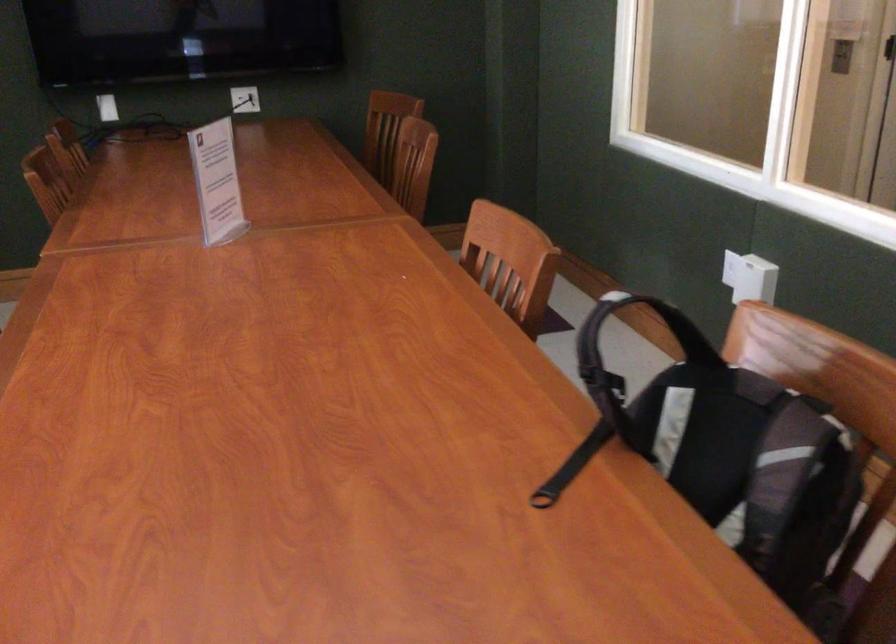
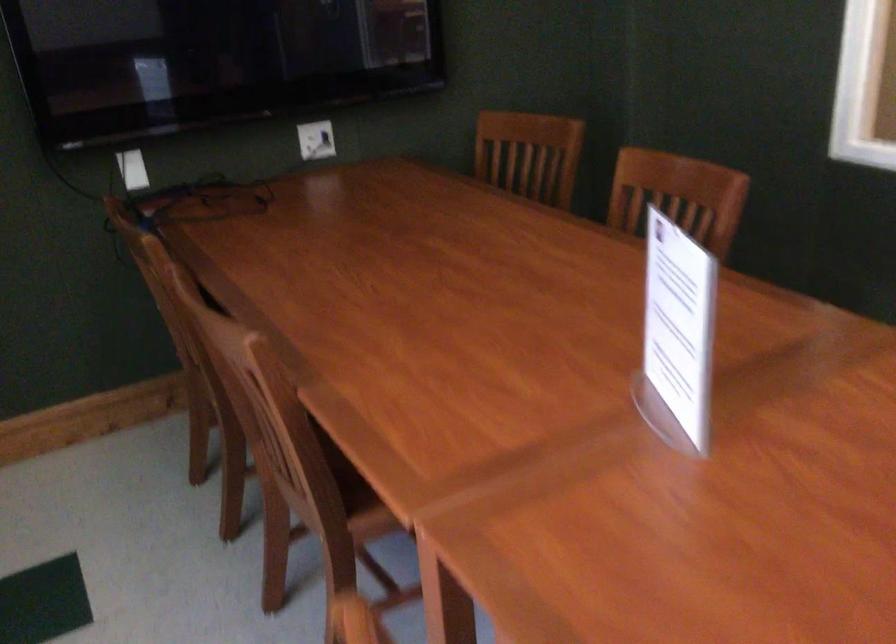
Locate, in the second image, the point that corresponds to pixel 395 120 in the first image.

(529, 154)